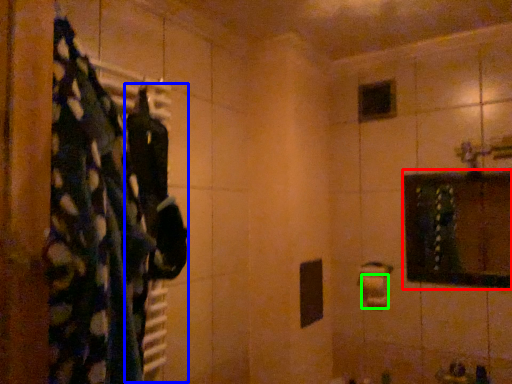
Question: Which object is the closest to the medicine cabinet (highlighted by a red box)? Choose among these: clothing (highlighted by a blue box) or toilet paper (highlighted by a green box).

Choices:
 (A) clothing
 (B) toilet paper

Answer: (B)